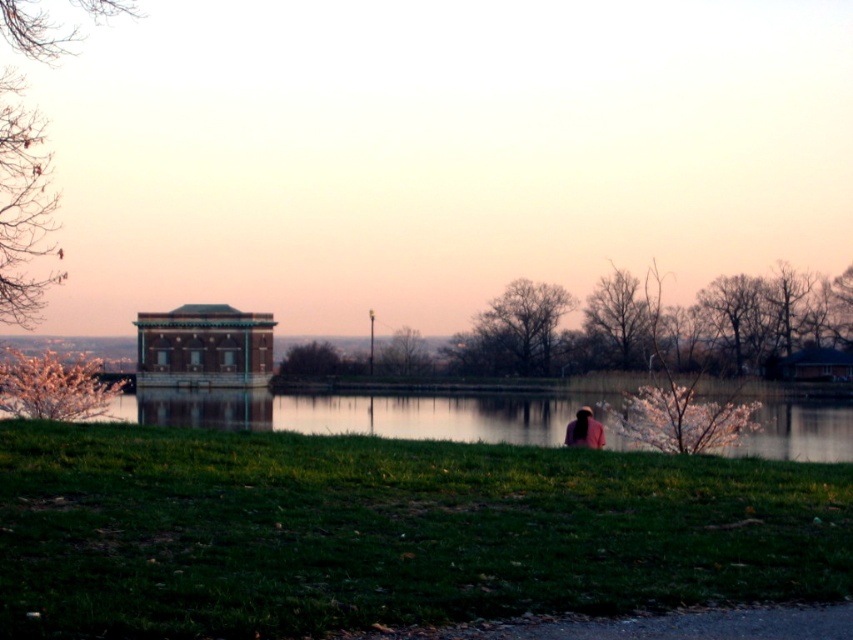
You are planning to set up a picnic blanket in the green grass at lower center. Considering the space available, will the matte gray gazebo at center interfere with your setup?

The green grass at lower center is wider than the matte gray gazebo at center, so there should be enough space to set up the picnic blanket without interference from the gazebo.

You are standing at the point labeled point (252,317) and want to walk towards the point labeled point (550,442). Based on the scene description, will you have to walk through any obstacles or open spaces?

The point labeled point (550,442) is in front of point labeled point (252,317), so you will be walking towards an open space with a grassy area and calm water, so no obstacles are mentioned in the scene description.

You are standing at the viewpoint and want to reach the point marked as point (844, 452). If you can walk 60 meters in 2 minutes, how long will it take you to reach that point?

The distance between you and point (844, 452) is 59.68 meters. Since you can walk 60 meters in 2 minutes, it will take approximately 2 minutes to reach the point.